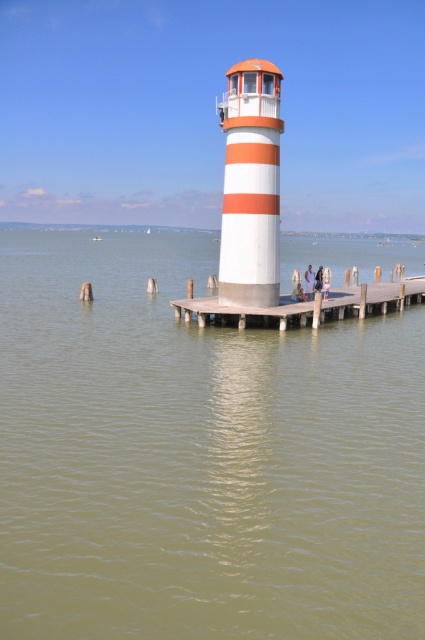
Question: Which of the following is the farthest from the observer?

Choices:
 (A) greenish water at center
 (B) wooden dock at center

Answer: (B)

Question: Does greenish water at center have a smaller size compared to white fabric person at center?

Choices:
 (A) yes
 (B) no

Answer: (B)

Question: Does greenish water at center have a lesser width compared to white striped lighthouse at center?

Choices:
 (A) yes
 (B) no

Answer: (B)

Question: Among these objects, which one is farthest from the camera?

Choices:
 (A) white matte person at center
 (B) greenish water at center
 (C) white fabric person at center
 (D) white striped lighthouse at center

Answer: (C)

Question: Considering the real-world distances, which object is farthest from the white fabric person at center?

Choices:
 (A) white striped lighthouse at center
 (B) white matte person at center
 (C) wooden dock at center
 (D) greenish water at center

Answer: (D)

Question: Can you confirm if white striped lighthouse at center is positioned to the right of wooden dock at center?

Choices:
 (A) no
 (B) yes

Answer: (A)